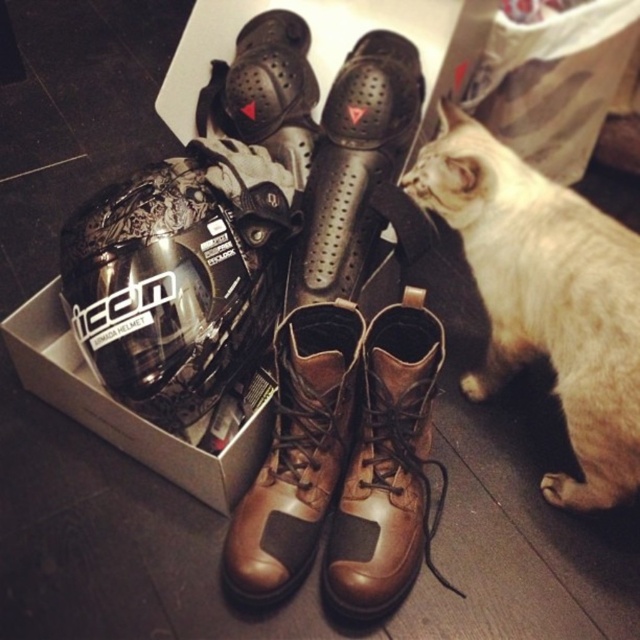
Does brown leather boot at center have a larger size compared to brown leather boots at center?

Indeed, brown leather boot at center has a larger size compared to brown leather boots at center.

Where is `brown leather boot at center`? brown leather boot at center is located at coordinates (388, 467).

Which is behind, point (627, 490) or point (276, 445)?

Positioned behind is point (276, 445).

Is point (579, 429) in front of point (323, 442)?

That is True.

Does point (586, 323) come in front of point (301, 358)?

Yes, it is.

What are the coordinates of `white fur cat at lower right` in the screenshot? It's located at (545, 296).

Which is above, white fur cat at lower right or metallic silver helmet at upper left?

Positioned higher is white fur cat at lower right.

Can you confirm if white fur cat at lower right is wider than metallic silver helmet at upper left?

No.

Is point (506, 253) farther from camera compared to point (17, 348)?

No, (506, 253) is in front of (17, 348).

Identify the location of white fur cat at lower right. The height and width of the screenshot is (640, 640). (545, 296).